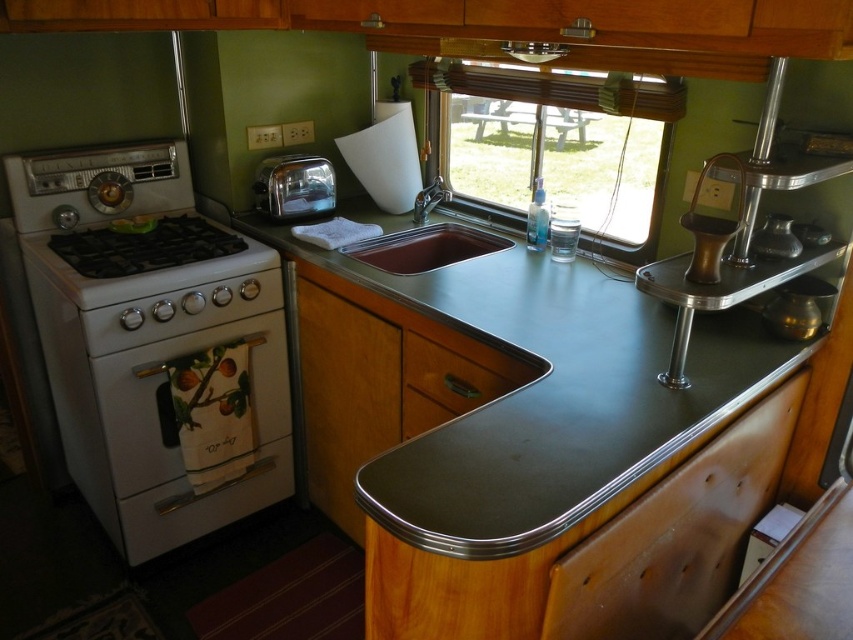
You are a chef preparing to place a 12 inch diameter plate on the metallic gray countertop at center. There is also a polished chrome toaster at center nearby. Will the plate fit on the countertop without touching the toaster?

The metallic gray countertop at center and polished chrome toaster at center are 21.54 inches apart. Since the plate is 12 inches in diameter, which is 12 inches wide, the distance between them is sufficient. The plate can be placed on the countertop without touching the toaster.

Looking at this image, you are a chef standing in front of the kitchen. You need to reach the metallic gray countertop at center to place a hot pan. Considering your arm length is 70 centimeters, can you comfortably place the pan on the countertop without moving closer?

The metallic gray countertop at center is 91.85 centimeters away from you. Since your arm length is only 70 centimeters, you cannot comfortably reach it without moving closer.

From the picture: What is located at the coordinates point (502, 392) in the image?

The point (502, 392) in the image corresponds to the metallic gray countertop at center.